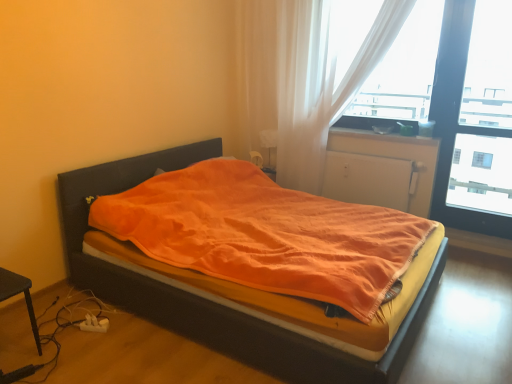
At what (x,y) coordinates should I click in order to perform the action: click on vacant space in front of white plastic charger at lower left. Please return your answer as a coordinate pair (x, y). This screenshot has height=384, width=512. Looking at the image, I should click on (90, 349).